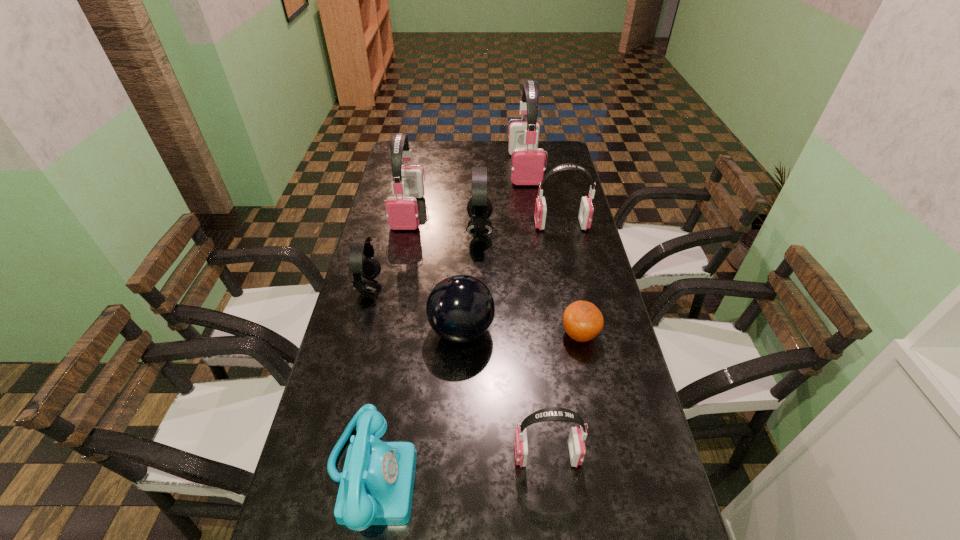
This screenshot has height=540, width=960. In order to click on the farthest earphone in this screenshot , I will do `click(527, 160)`.

This screenshot has height=540, width=960. Find the location of `the tallest object`. the tallest object is located at coordinates [527, 160].

Find the location of a particular element. the fifth shortest earphone is located at coordinates (402, 212).

At what (x,y) coordinates should I click in order to perform the action: click on the third smallest pink earphone. Please return your answer as a coordinate pair (x, y). The width and height of the screenshot is (960, 540). Looking at the image, I should click on (402, 212).

Where is `the third earphone from left to right`? Image resolution: width=960 pixels, height=540 pixels. the third earphone from left to right is located at coordinates (479, 208).

At what (x,y) coordinates should I click in order to perform the action: click on the bigger black earphone. Please return your answer as a coordinate pair (x, y). This screenshot has width=960, height=540. Looking at the image, I should click on (479, 208).

Locate an element on the screen. This screenshot has width=960, height=540. the second smallest pink earphone is located at coordinates (586, 210).

The image size is (960, 540). Find the location of `black bowling ball`. black bowling ball is located at coordinates (460, 308).

What are the coordinates of `the second nearest earphone` in the screenshot? It's located at (368, 267).

Identify the location of the nearer black earphone. point(368,267).